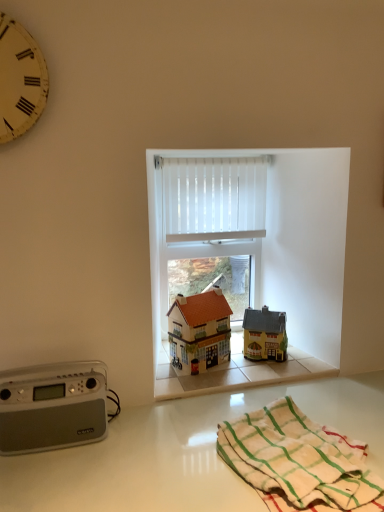
I want to click on empty space that is to the right of yellow matte house at center, the second toy in the left-to-right sequence, so click(x=303, y=359).